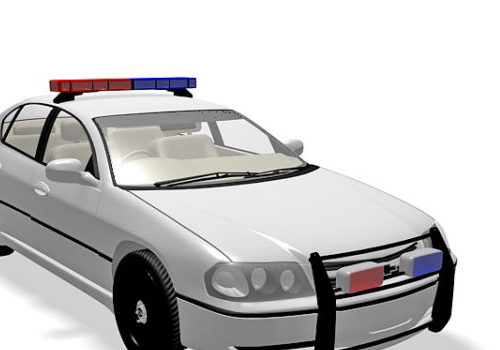
This screenshot has width=500, height=350. I want to click on hood, so click(x=297, y=216).